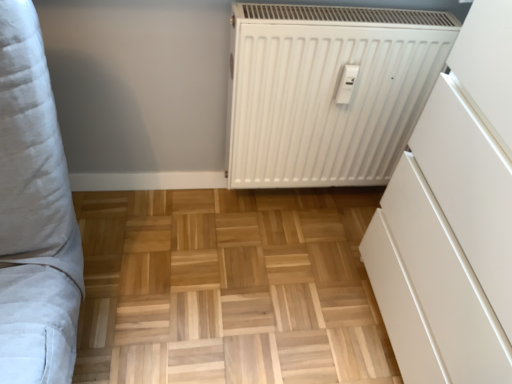
Find the location of `white matte radiator at center`. white matte radiator at center is located at coordinates (328, 91).

Measure the distance between white matte radiator at center and camera.

The distance of white matte radiator at center from camera is 1.06 meters.

This screenshot has width=512, height=384. What do you see at coordinates (328, 91) in the screenshot? I see `white matte radiator at center` at bounding box center [328, 91].

In order to face white matte radiator at center, should I rotate leftwards or rightwards?

Rotate your view right by about 10.780°.

Where is `white matte radiator at center`? Image resolution: width=512 pixels, height=384 pixels. white matte radiator at center is located at coordinates (328, 91).